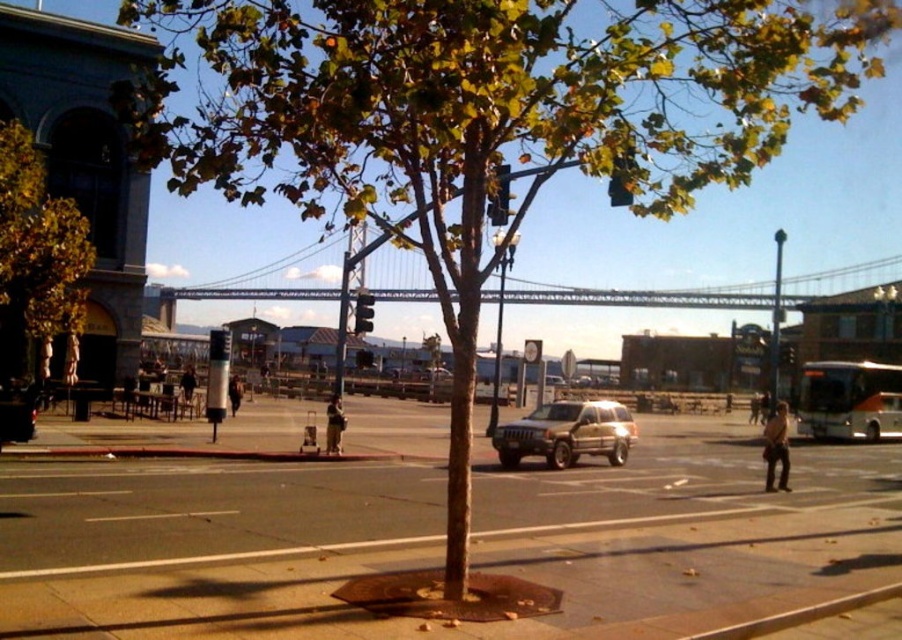
You are standing at the center of the road in the image. Which direction should you look to see the green leafy tree at left?

The green leafy tree at left is located at the left side of the image, so you should look to your left to see it.

You are a delivery driver approaching the intersection where the metallic gray suspension bridge at center and the gold metallic suv at center are located. Your GPS says you need to turn left onto the bridge. Can your truck, which is 10 feet wide, safely pass through the space between the two objects?

The metallic gray suspension bridge at center is larger in size than the gold metallic suv at center, but the exact width of the bridge or the distance between them isn

You are standing at the camera position and want to reach the point at coordinates (x=0, y=198). The path to that point is blocked by a tree with a trunk 2 feet in diameter. Can you walk around the tree on either side to reach the point?

The point at coordinates (x=0, y=198) is 65.94 feet away from the camera. Since the tree trunk is only 2 feet wide, you can easily walk around it on either side to reach the point.